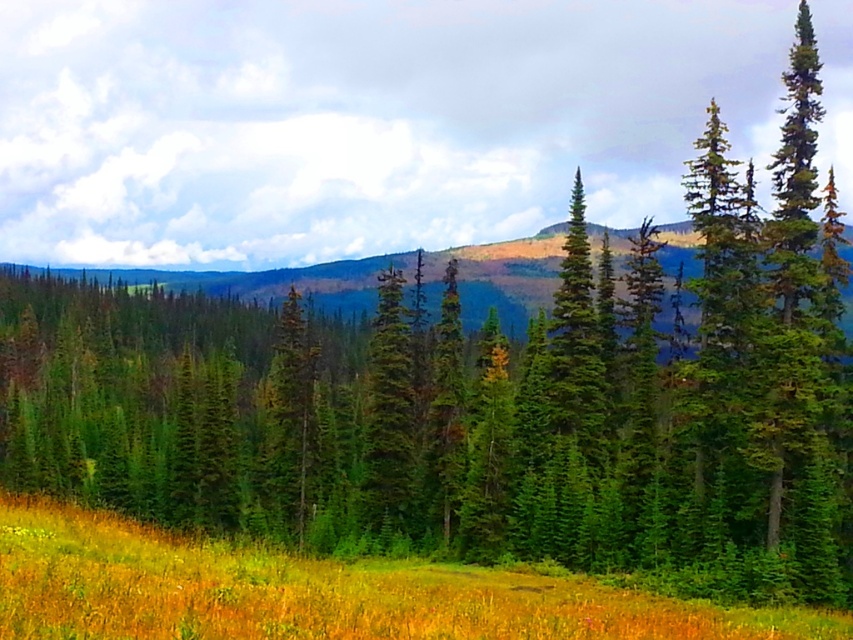
Is the position of yellow-green grass at lower center more distant than that of green matte tree at center?

No.

Who is positioned more to the right, yellow-green grass at lower center or green matte tree at center?

yellow-green grass at lower center is more to the right.

Image resolution: width=853 pixels, height=640 pixels. What do you see at coordinates (318, 592) in the screenshot? I see `yellow-green grass at lower center` at bounding box center [318, 592].

Identify the location of yellow-green grass at lower center. (318, 592).